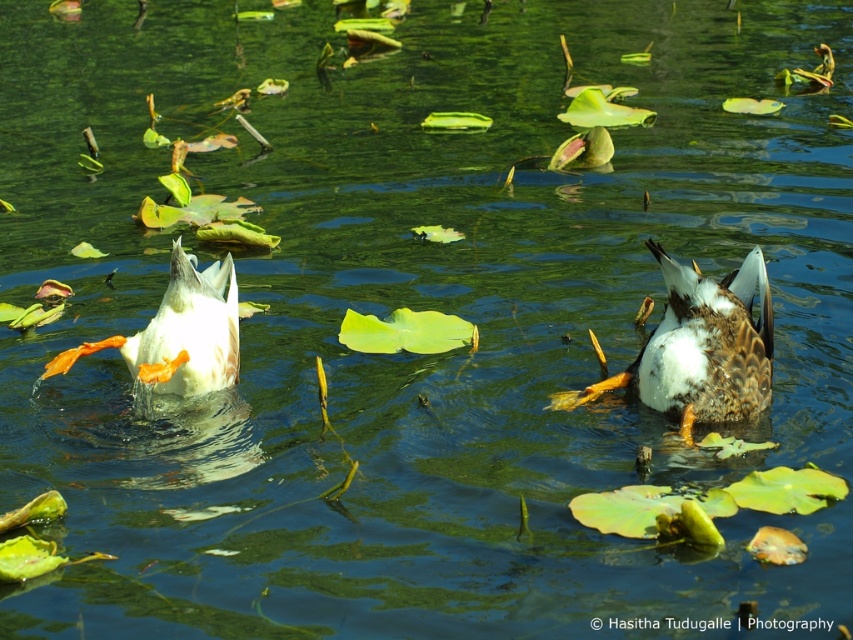
You are a photographer trying to capture the brown speckled duck at center in the center of your photo. Given its current position at point coordinates, can you confirm if the duck is already centered in the frame?

The brown speckled duck at center is located at coordinates point (700, 348), which is close to the center of the frame but not exactly at the center point (426, 320). Therefore, it is slightly off center and needs adjustment to be perfectly centered.

In the scene shown: You are a photographer trying to capture both the brown speckled duck at center and the white matte duck at left in the same frame. Based on their positions, can you determine which duck is closer to the camera?

The brown speckled duck at center is positioned under the white matte duck at left, meaning it is closer to the camera than the white matte duck at left.